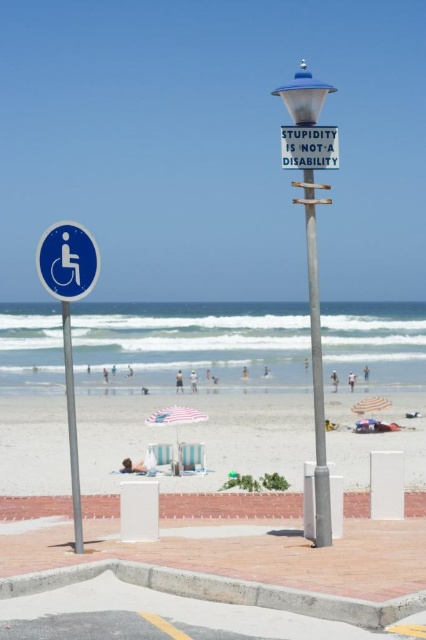
You are planning to set up a beach chair and want to ensure it has enough shade. Given the beach umbrella at center and the blue plastic wheelchair sign at left, which object provides more coverage for shade?

The beach umbrella at center has a larger size compared to the blue plastic wheelchair sign at left, so it provides more shade coverage.